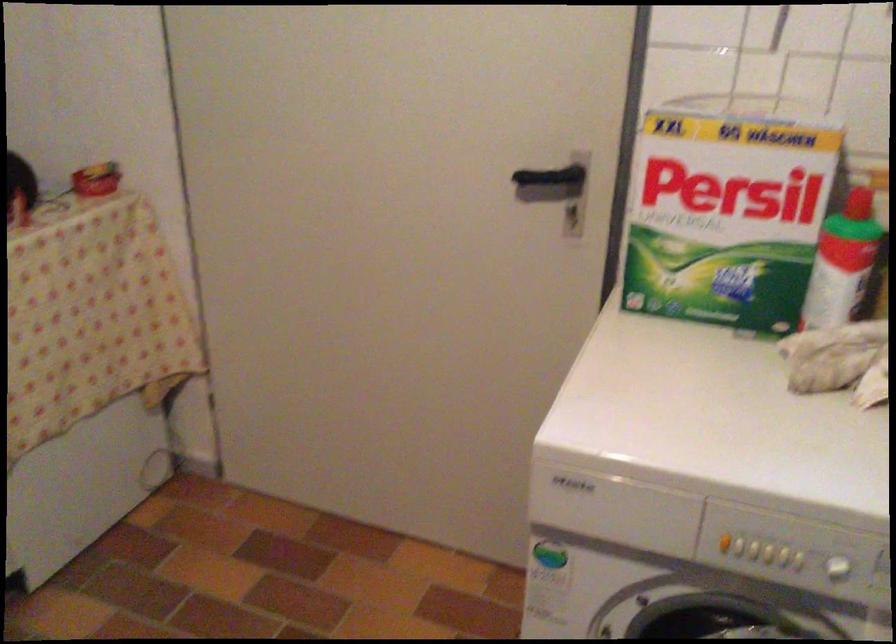
What do you see at coordinates (724, 542) in the screenshot?
I see `a orange machine button` at bounding box center [724, 542].